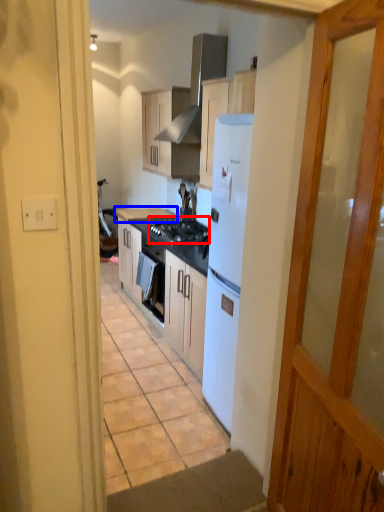
Question: Which object is closer to the camera taking this photo, gas stove (highlighted by a red box) or countertop (highlighted by a blue box)?

Choices:
 (A) gas stove
 (B) countertop

Answer: (A)